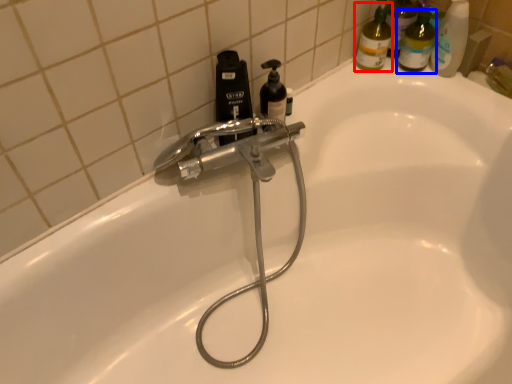
Question: Which object appears closest to the camera in this image, cleaning product (highlighted by a red box) or toiletry (highlighted by a blue box)?

Choices:
 (A) cleaning product
 (B) toiletry

Answer: (B)